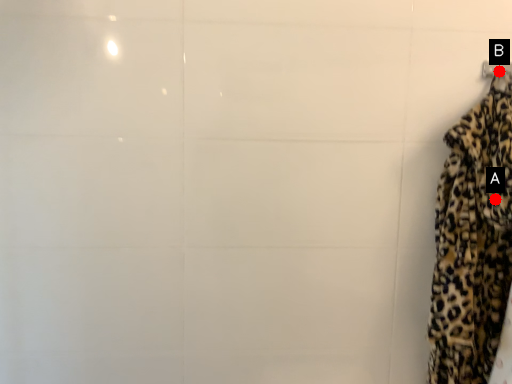
Question: Two points are circled on the image, labeled by A and B beside each circle. Which point is further to the camera?

Choices:
 (A) A is further
 (B) B is further

Answer: (B)